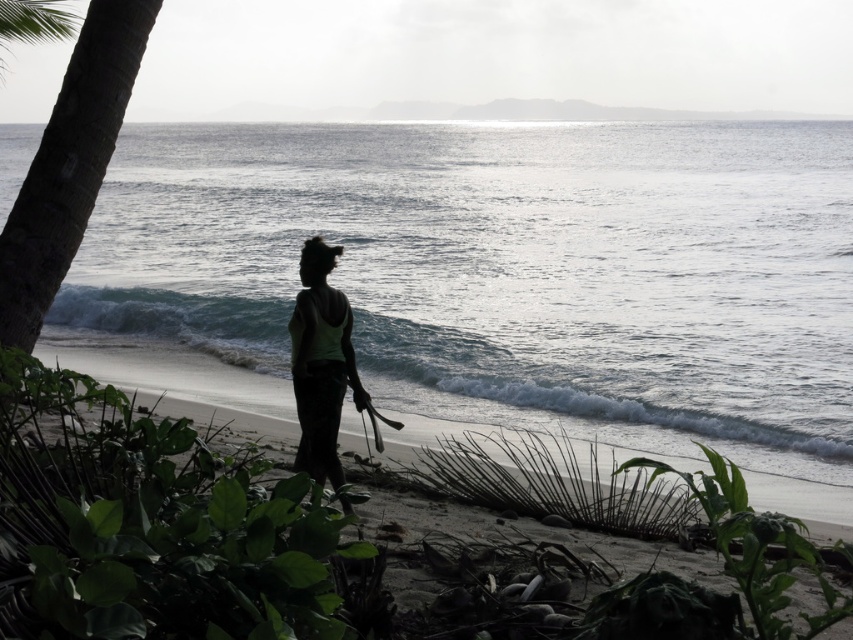
Who is more distant from viewer, (167, 157) or (318, 244)?

Point (167, 157)

Between glistening silver water at center and silhouette fabric woman at center, which one has less height?

→ silhouette fabric woman at center is shorter.

Image resolution: width=853 pixels, height=640 pixels. Describe the element at coordinates (508, 269) in the screenshot. I see `glistening silver water at center` at that location.

Identify the location of glistening silver water at center. The width and height of the screenshot is (853, 640). (508, 269).

Between brown rough palm tree at left and silhouette fabric woman at center, which one has more height?

Answer: brown rough palm tree at left is taller.

I want to click on brown rough palm tree at left, so click(x=68, y=163).

In order to click on brown rough palm tree at left in this screenshot , I will do `click(68, 163)`.

Does green leafy plant at center have a greater height compared to silhouette fabric woman at center?

Incorrect, green leafy plant at center's height is not larger of silhouette fabric woman at center's.

Between point (38, 442) and point (343, 502), which one is positioned behind?

The point (38, 442) is more distant.

In order to click on green leafy plant at center in this screenshot , I will do `click(149, 524)`.